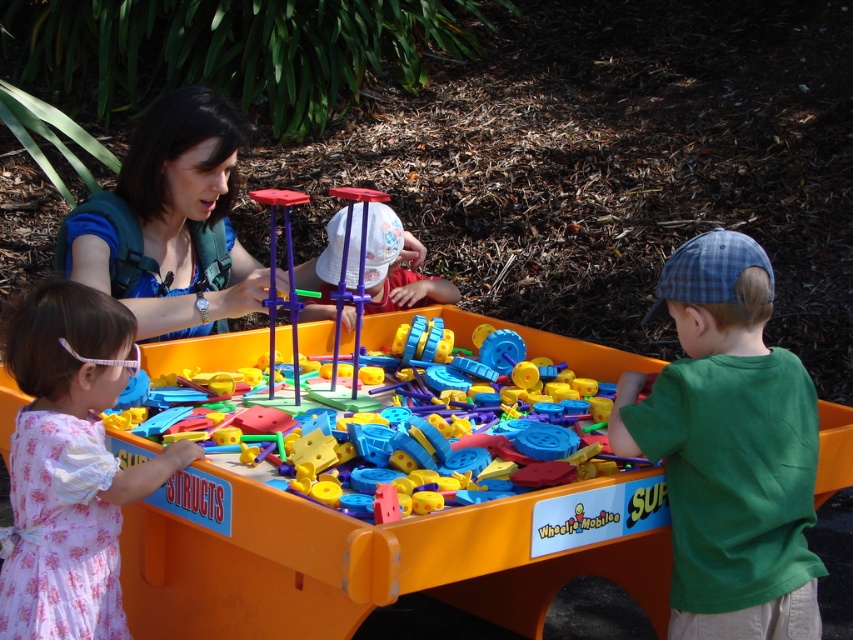
Please look at the image. There is a point at coordinates (x=68, y=467). What object is located at this point?

The pink floral dress at lower left is located at point (x=68, y=467).

You are a child at the Wheelie Mobiles table and want to pick up two toy pieces. One is at point (682, 291) and the other at point (469, 467). Which toy piece will you reach first if you move towards them from your current position?

The toy piece at point (682, 291) is closer to you than the one at point (469, 467), so you will reach it first.

You are standing at the center of the image and want to hand a toy to the green cotton shirt at right. Which direction should you move to reach them?

Since the green cotton shirt at right is located at point (729, 449), you should move to the right and slightly upwards from the center to reach them.